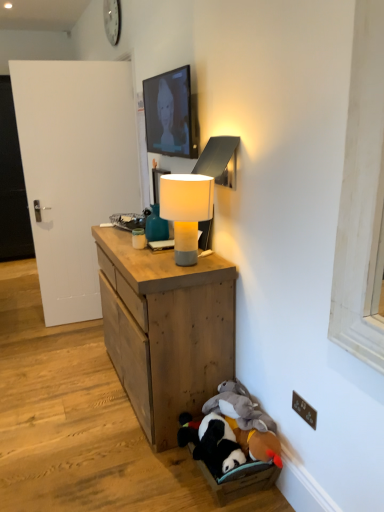
Question: Can you confirm if matte black tv at upper center is wider than brown plastic electric outlet at lower right?

Choices:
 (A) yes
 (B) no

Answer: (A)

Question: Can you confirm if matte black tv at upper center is bigger than brown plastic electric outlet at lower right?

Choices:
 (A) no
 (B) yes

Answer: (B)

Question: From a real-world perspective, is matte black tv at upper center under brown plastic electric outlet at lower right?

Choices:
 (A) yes
 (B) no

Answer: (B)

Question: From a real-world perspective, is matte black tv at upper center physically above brown plastic electric outlet at lower right?

Choices:
 (A) no
 (B) yes

Answer: (B)

Question: Considering the relative sizes of matte black tv at upper center and brown plastic electric outlet at lower right in the image provided, is matte black tv at upper center thinner than brown plastic electric outlet at lower right?

Choices:
 (A) no
 (B) yes

Answer: (A)

Question: From a real-world perspective, relative to matte black tv at upper center, is white matte door at left, the 1th door from the right, vertically above or below?

Choices:
 (A) above
 (B) below

Answer: (B)

Question: Is white matte door at left, the 1th door from the right, inside or outside of matte black tv at upper center?

Choices:
 (A) outside
 (B) inside

Answer: (A)

Question: From the image's perspective, relative to matte black tv at upper center, is white matte door at left, the 1th door from the right, above or below?

Choices:
 (A) below
 (B) above

Answer: (A)

Question: In the image, is white matte door at left, the 1th door when ordered from front to back, positioned in front of or behind matte black tv at upper center?

Choices:
 (A) front
 (B) behind

Answer: (B)

Question: In terms of width, does white plastic clock at upper center look wider or thinner when compared to white matte door at left, the first door positioned from the back?

Choices:
 (A) thin
 (B) wide

Answer: (A)

Question: Which is correct: white plastic clock at upper center is inside white matte door at left, the first door positioned from the back, or outside of it?

Choices:
 (A) outside
 (B) inside

Answer: (A)

Question: Is white plastic clock at upper center taller or shorter than white matte door at left, the first door positioned from the back?

Choices:
 (A) short
 (B) tall

Answer: (A)

Question: In terms of size, does white plastic clock at upper center appear bigger or smaller than white matte door at left, which ranks as the 2th door in front-to-back order?

Choices:
 (A) small
 (B) big

Answer: (A)

Question: Is wooden cabinet at center wider or thinner than matte black tv at upper center?

Choices:
 (A) wide
 (B) thin

Answer: (A)

Question: In the image, is wooden cabinet at center positioned in front of or behind matte black tv at upper center?

Choices:
 (A) front
 (B) behind

Answer: (A)